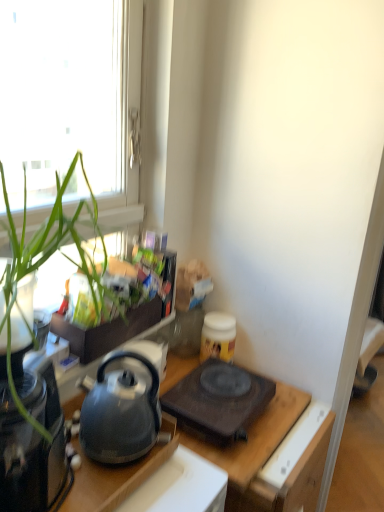
Question: From a real-world perspective, relative to transparent glass window at upper left, is matte black kettle at center vertically above or below?

Choices:
 (A) below
 (B) above

Answer: (A)

Question: Considering their positions, is matte black kettle at center located in front of or behind transparent glass window at upper left?

Choices:
 (A) front
 (B) behind

Answer: (B)

Question: Considering the real-world distances, which object is closest to the green leafy plant at left?

Choices:
 (A) black matte gas stove at center
 (B) transparent glass window at upper left
 (C) black glass coffee maker at left
 (D) matte black kettle at center
 (E) matte black kettle at left

Answer: (B)

Question: Which is nearer to the black glass coffee maker at left?

Choices:
 (A) transparent glass window at upper left
 (B) matte black kettle at center
 (C) green leafy plant at left
 (D) black matte gas stove at center
 (E) matte black kettle at left

Answer: (E)